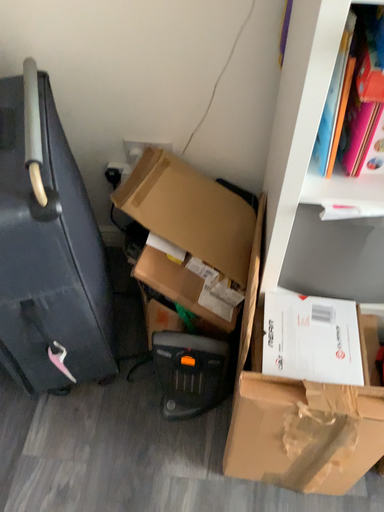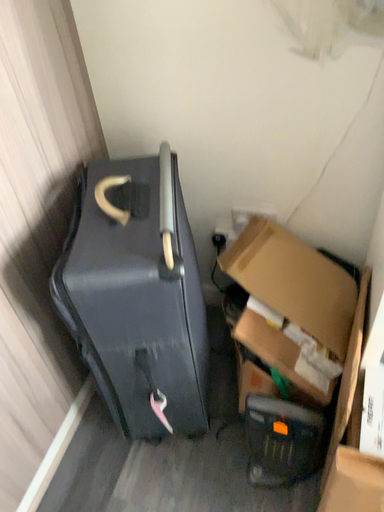
Question: Which way did the camera rotate in the video?

Choices:
 (A) rotated upward
 (B) rotated downward

Answer: (A)